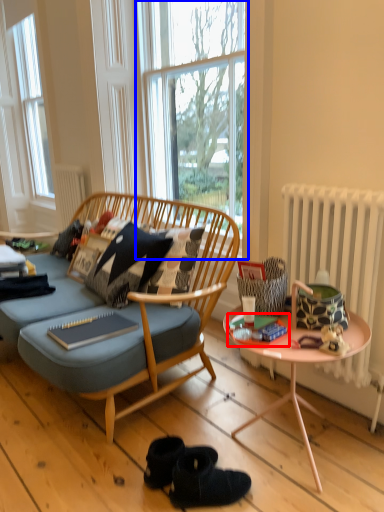
Question: Among these objects, which one is farthest to the camera, magazine (highlighted by a red box) or window (highlighted by a blue box)?

Choices:
 (A) magazine
 (B) window

Answer: (B)